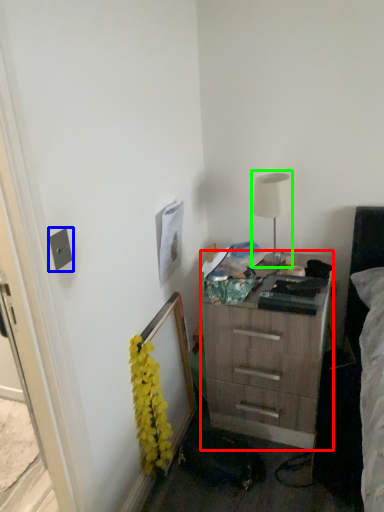
Question: Based on their relative distances, which object is farther from chest of drawers (highlighted by a red box)? Choose from electric outlet (highlighted by a blue box) and table lamp (highlighted by a green box).

Choices:
 (A) electric outlet
 (B) table lamp

Answer: (A)